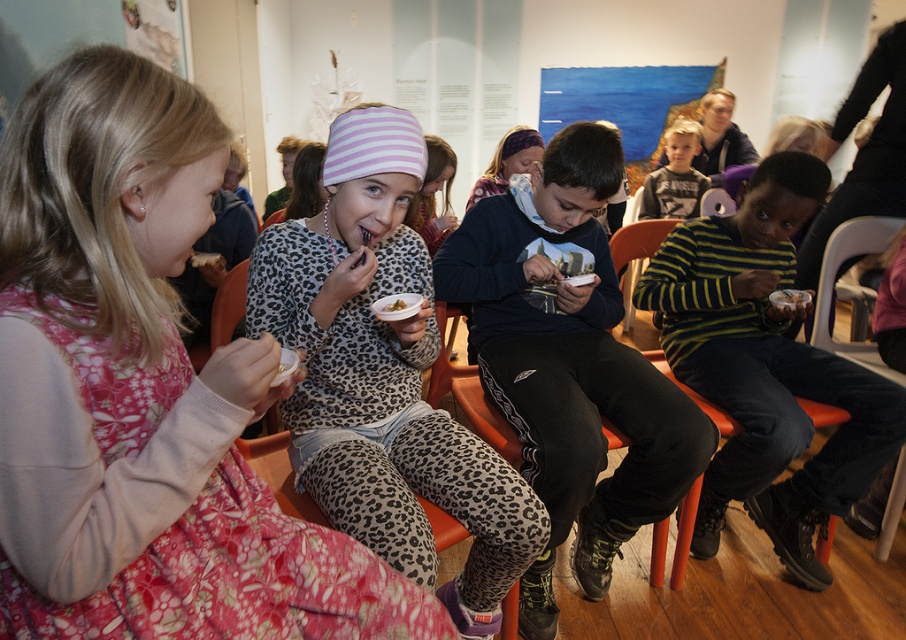
Which is above, white plastic chair at lower right or orange plastic chair at right?

orange plastic chair at right

Describe the element at coordinates (834, 284) in the screenshot. I see `white plastic chair at lower right` at that location.

Where is `white plastic chair at lower right`? white plastic chair at lower right is located at coordinates (834, 284).

In the scene shown: Between leopard print sweater at center and green leafy salad at center, which one appears on the right side from the viewer's perspective?

green leafy salad at center is more to the right.

Who is taller, leopard print sweater at center or green leafy salad at center?

leopard print sweater at center is taller.

Who is more distant from viewer, (x=295, y=276) or (x=394, y=307)?

Point (x=295, y=276)

The image size is (906, 640). Find the location of `leopard print sweater at center`. leopard print sweater at center is located at coordinates (383, 376).

Can you confirm if pink striped fabric headband at upper center is smaller than green leafy salad at center?

Incorrect, pink striped fabric headband at upper center is not smaller in size than green leafy salad at center.

Between pink striped fabric headband at upper center and green leafy salad at center, which one has less height?

green leafy salad at center is shorter.

Is point (213, 570) positioned after point (405, 304)?

No, it is in front of (405, 304).

Where is `pink striped fabric headband at upper center`? The width and height of the screenshot is (906, 640). pink striped fabric headband at upper center is located at coordinates (143, 394).